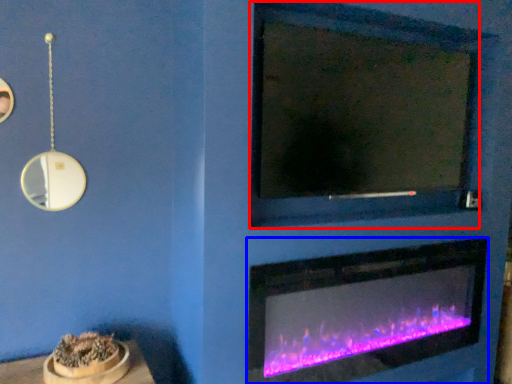
Question: Which point is closer to the camera, mirror (highlighted by a red box) or fireplace (highlighted by a blue box)?

Choices:
 (A) mirror
 (B) fireplace

Answer: (A)